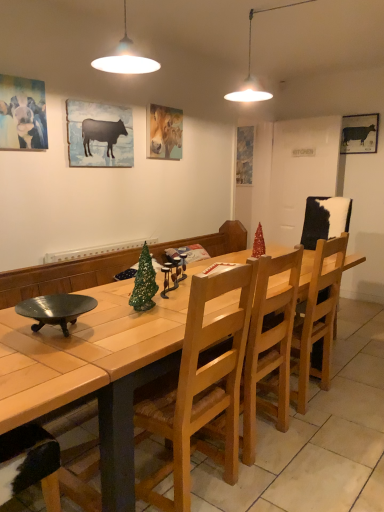
The image size is (384, 512). In order to click on vacant space to the right of wooden chair at center, the 1th chair when ordered from right to left in this screenshot , I will do `click(353, 394)`.